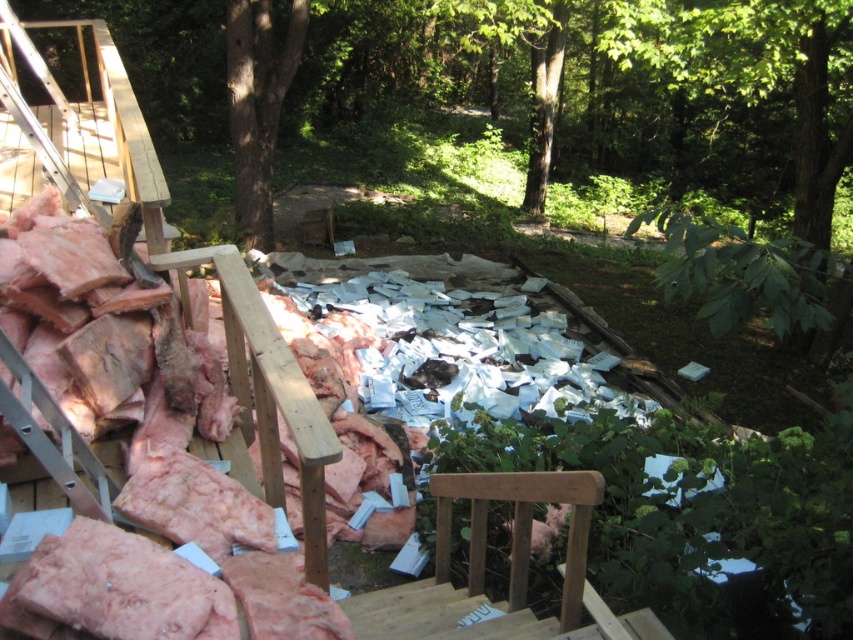
Is point (247, 157) closer to viewer compared to point (10, 77)?

No, (247, 157) is further to viewer.

Which is more to the left, green leafy tree at center or wooden ladder at upper left?

green leafy tree at center is more to the left.

This screenshot has width=853, height=640. I want to click on green leafy tree at center, so click(258, 104).